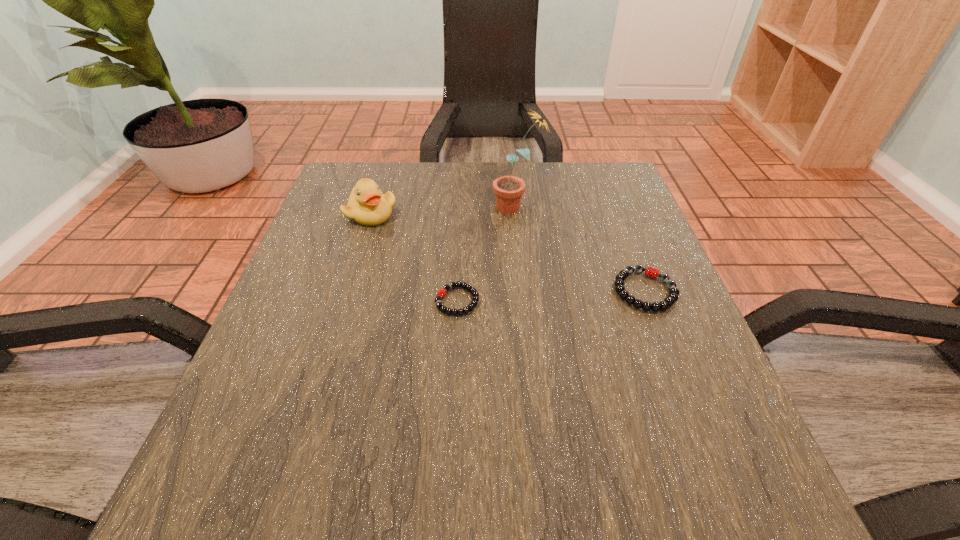
Locate an element on the screen. free region that satisfies the following two spatial constraints: 1. on the flower of the rightmost object; 2. on the right side of the sunflower is located at coordinates (526, 291).

At what (x,y) coordinates should I click in order to perform the action: click on free location that satisfies the following two spatial constraints: 1. on the flower of the sunflower; 2. on the beak of the leftmost object. Please return your answer as a coordinate pair (x, y). Image resolution: width=960 pixels, height=540 pixels. Looking at the image, I should click on (517, 214).

At what (x,y) coordinates should I click in order to perform the action: click on free space that satisfies the following two spatial constraints: 1. on the flower of the tallest object; 2. on the left side of the second shortest object. Please return your answer as a coordinate pair (x, y). This screenshot has height=540, width=960. Looking at the image, I should click on (526, 291).

Where is `blank space that satisfies the following two spatial constraints: 1. on the flower of the sunflower; 2. on the back side of the rightmost object`? The height and width of the screenshot is (540, 960). blank space that satisfies the following two spatial constraints: 1. on the flower of the sunflower; 2. on the back side of the rightmost object is located at coordinates (526, 291).